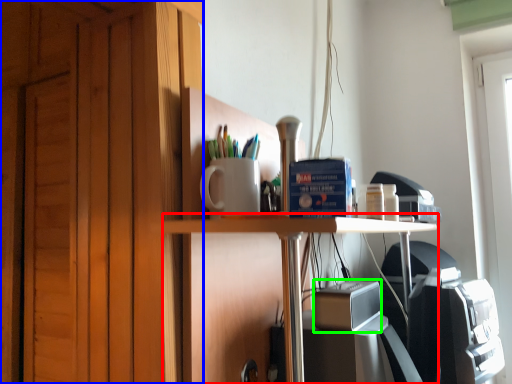
Question: Which object is the farthest from table (highlighted by a red box)? Choose among these: dresser (highlighted by a blue box) or appliance (highlighted by a green box).

Choices:
 (A) dresser
 (B) appliance

Answer: (A)